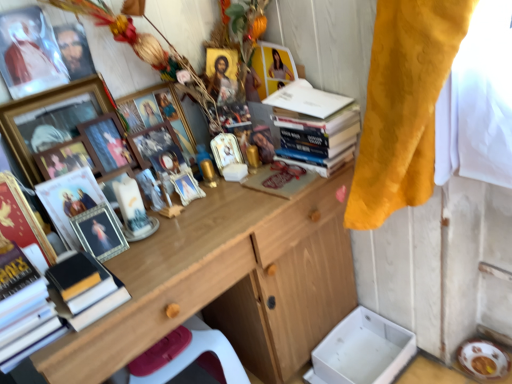
This screenshot has height=384, width=512. I want to click on vacant space in between matte glass picture frame at center, which appears as the sixth picture frame when viewed from the left, and matte brown book at center, the second magazine positioned from the left, so click(x=219, y=208).